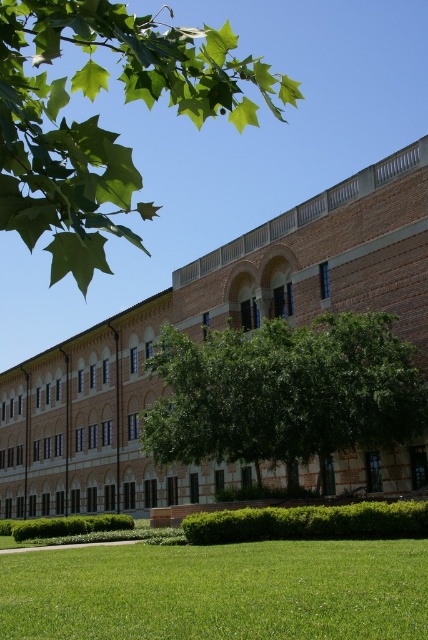
You are a landscape architect designing a new garden. You have to choose between placing a statue in the area with the green leafy tree at upper left or the green grass at lower center. Which area has more space for the statue?

The green leafy tree at upper left is bigger than the green grass at lower center, so there is more space available in the area with the green leafy tree at upper left for placing the statue.

You are standing on the paved walkway leading to the building and notice the green leafy tree at upper left and the green grass at lower center. Which of these two items is located to the left of the other?

The green leafy tree at upper left is positioned on the left side of green grass at lower center.